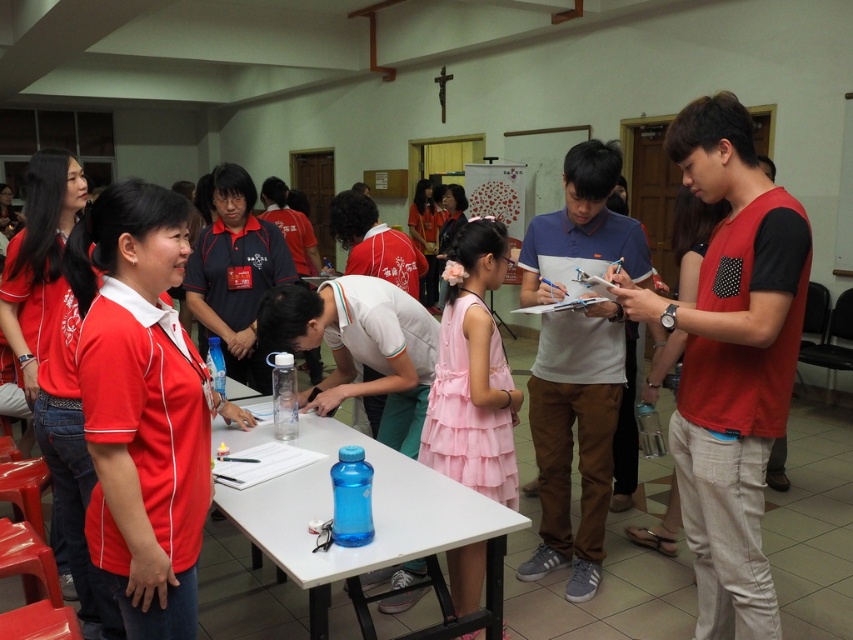
Question: Which is farther from the blue plastic table at center?

Choices:
 (A) pink satin dress at center
 (B) white paper at center

Answer: (B)

Question: Which of these objects is positioned closest to the blue plastic table at center?

Choices:
 (A) white paper at center
 (B) pink satin dress at center

Answer: (B)

Question: Which object appears closest to the camera in this image?

Choices:
 (A) blue plastic table at center
 (B) white paper at center

Answer: (A)

Question: Can you confirm if pink satin dress at center is wider than white paper at center?

Choices:
 (A) yes
 (B) no

Answer: (A)

Question: From the image, what is the correct spatial relationship of blue plastic table at center in relation to white paper at center?

Choices:
 (A) above
 (B) below

Answer: (B)

Question: Can you confirm if blue plastic table at center is positioned above white paper at center?

Choices:
 (A) yes
 (B) no

Answer: (B)